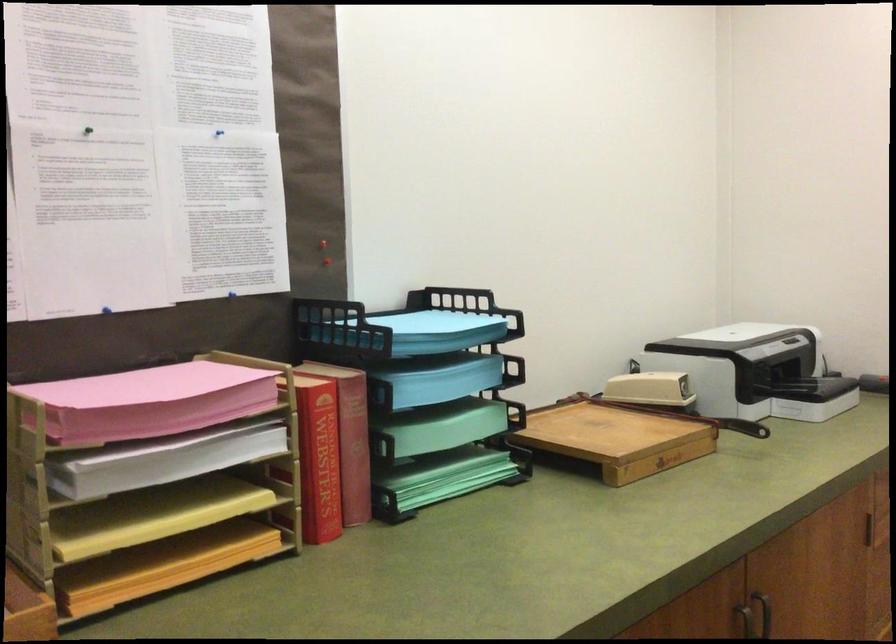
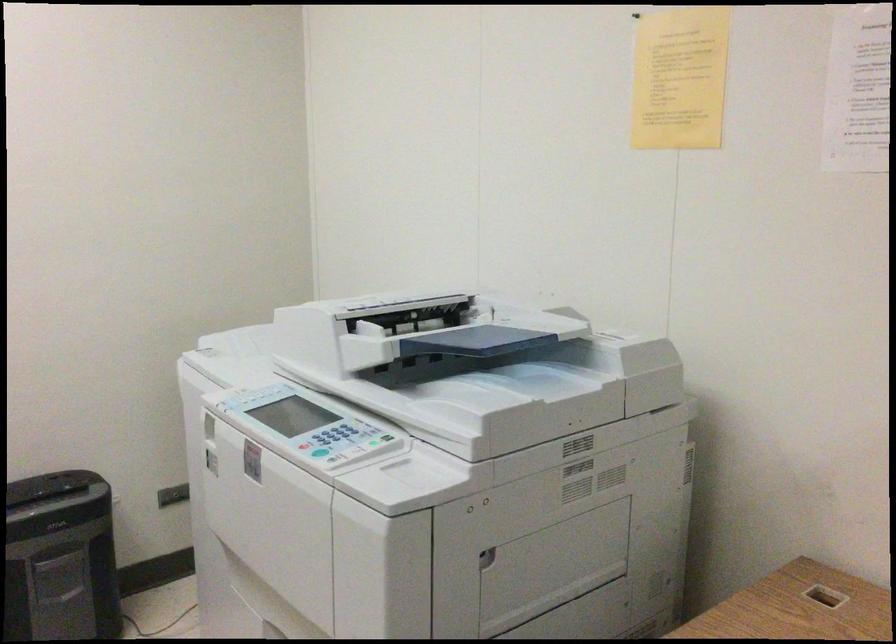
Question: The first image is from the beginning of the video and the second image is from the end. How did the camera likely rotate when shooting the video?

Choices:
 (A) Left
 (B) Right
 (C) Up
 (D) Down

Answer: (B)